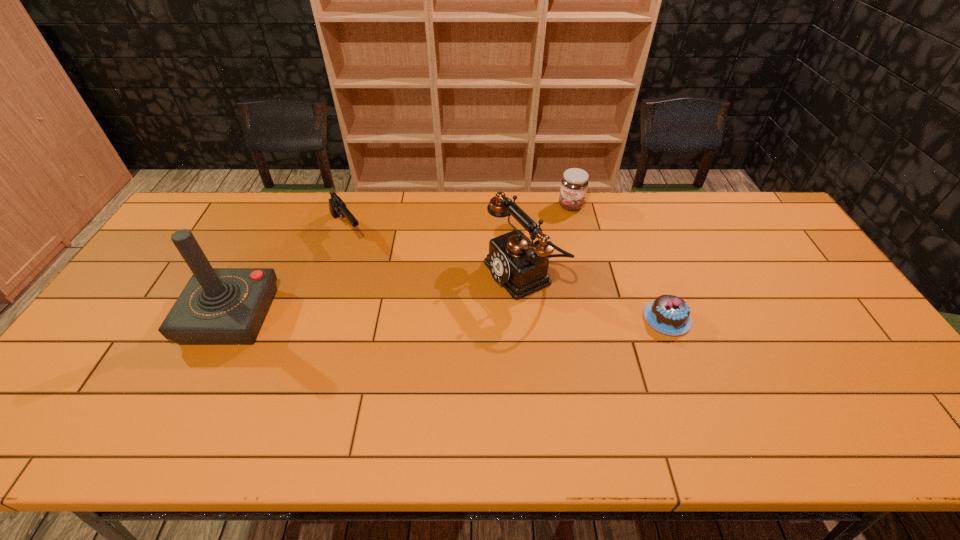
Image resolution: width=960 pixels, height=540 pixels. What are the coordinates of `joystick` in the screenshot? It's located at (219, 306).

At what (x,y) coordinates should I click in order to perform the action: click on the tallest object. Please return your answer as a coordinate pair (x, y). This screenshot has height=540, width=960. Looking at the image, I should click on (219, 306).

Where is `chocolate cake`? chocolate cake is located at coordinates (668, 314).

At what (x,y) coordinates should I click in order to perform the action: click on the shortest object. Please return your answer as a coordinate pair (x, y). The image size is (960, 540). Looking at the image, I should click on (668, 314).

Image resolution: width=960 pixels, height=540 pixels. What are the coordinates of `the fourth shortest object` in the screenshot? It's located at (521, 266).

Where is `the third object from left to right`? The width and height of the screenshot is (960, 540). the third object from left to right is located at coordinates (521, 266).

Find the location of a particular element. gun is located at coordinates (337, 207).

This screenshot has width=960, height=540. In order to click on the fourth object from left to right in this screenshot , I will do `click(574, 183)`.

Find the location of a particular element. vacant space located 0.100m on the rectangular base of the tallest object is located at coordinates (155, 316).

The image size is (960, 540). I want to click on free location located on the rectangular base of the tallest object, so click(x=152, y=316).